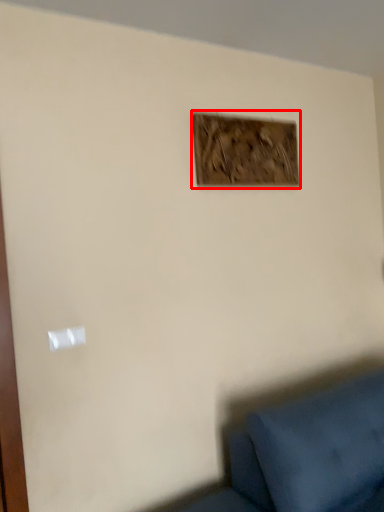
Question: Where is picture frame (annotated by the red box) located in relation to light switch in the image?

Choices:
 (A) right
 (B) left

Answer: (A)